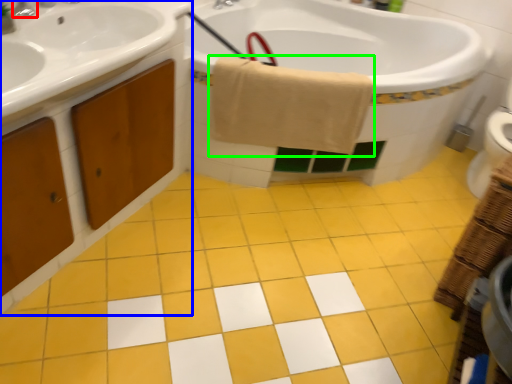
Question: Which is nearer to the tap (highlighted by a red box)? bathroom cabinet (highlighted by a blue box) or bath towel (highlighted by a green box).

Choices:
 (A) bathroom cabinet
 (B) bath towel

Answer: (A)